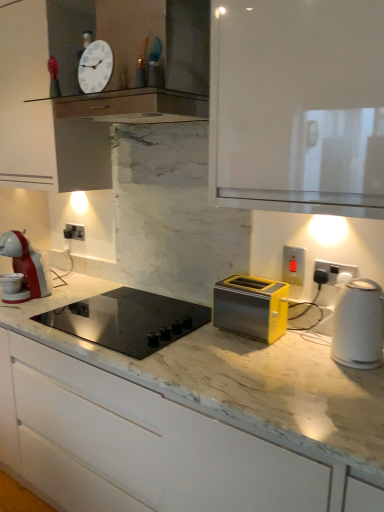
Question: From the image's perspective, is black glass cooktop at center above or below white plastic electric outlet at right, positioned as the first electric outlet in right-to-left order?

Choices:
 (A) above
 (B) below

Answer: (B)

Question: Based on their sizes in the image, would you say black glass cooktop at center is bigger or smaller than white plastic electric outlet at right, the 3th electric outlet from the left?

Choices:
 (A) small
 (B) big

Answer: (B)

Question: Considering the real-world distances, which object is farthest from the satin silver socket at center, the first electric outlet from the back?

Choices:
 (A) white glossy clock at upper center
 (B) white plastic electric outlet at right, the first electric outlet viewed from the front
 (C) black glass cooktop at center
 (D) matte plastic switch at upper right, the 2th electric outlet positioned from the right
 (E) white glossy cabinet at upper center, marked as the 1th cabinetry in a top-to-bottom arrangement

Answer: (B)

Question: Which object is the farthest from the white glossy clock at upper center?

Choices:
 (A) white glossy cabinet at upper center, the second cabinetry when ordered from bottom to top
 (B) satin silver socket at center, the first electric outlet from the back
 (C) white plastic electric outlet at right, positioned as the first electric outlet in right-to-left order
 (D) matte plastic switch at upper right, the 2th electric outlet in the left-to-right sequence
 (E) white glossy kettle at right

Answer: (E)